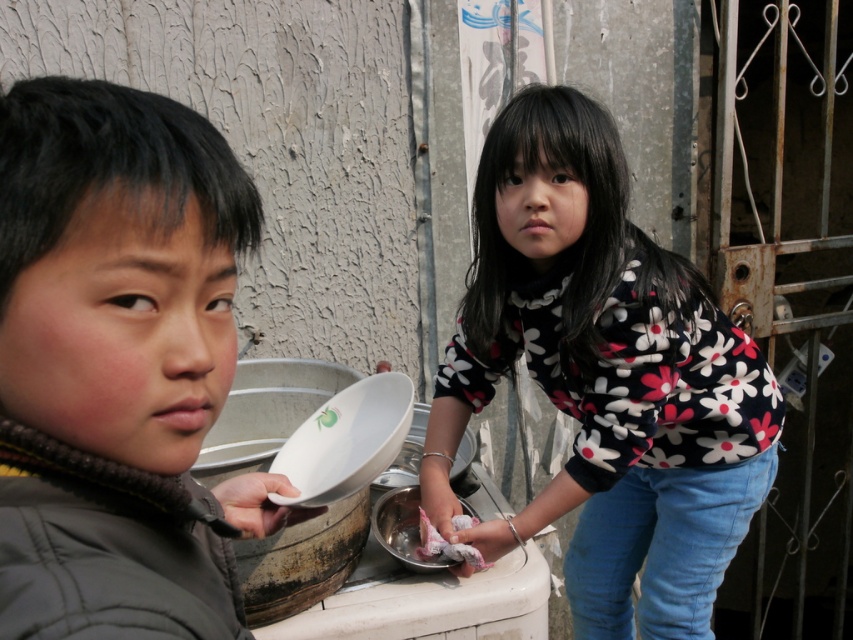
Question: Which of the following is the closest to the observer?

Choices:
 (A) matte gray jacket at left
 (B) white glossy plate at center

Answer: (A)

Question: Is matte gray jacket at left further to the viewer compared to white glossy plate at center?

Choices:
 (A) no
 (B) yes

Answer: (A)

Question: Is the position of matte gray jacket at left less distant than that of white glossy plate at center?

Choices:
 (A) no
 (B) yes

Answer: (B)

Question: Which point is closer to the camera taking this photo?

Choices:
 (A) (619, 368)
 (B) (289, 444)

Answer: (B)

Question: Does floral-patterned sweater at center have a larger size compared to matte gray jacket at left?

Choices:
 (A) yes
 (B) no

Answer: (A)

Question: Which object appears closest to the camera in this image?

Choices:
 (A) white fluffy food at lower center
 (B) floral-patterned sweater at center

Answer: (B)